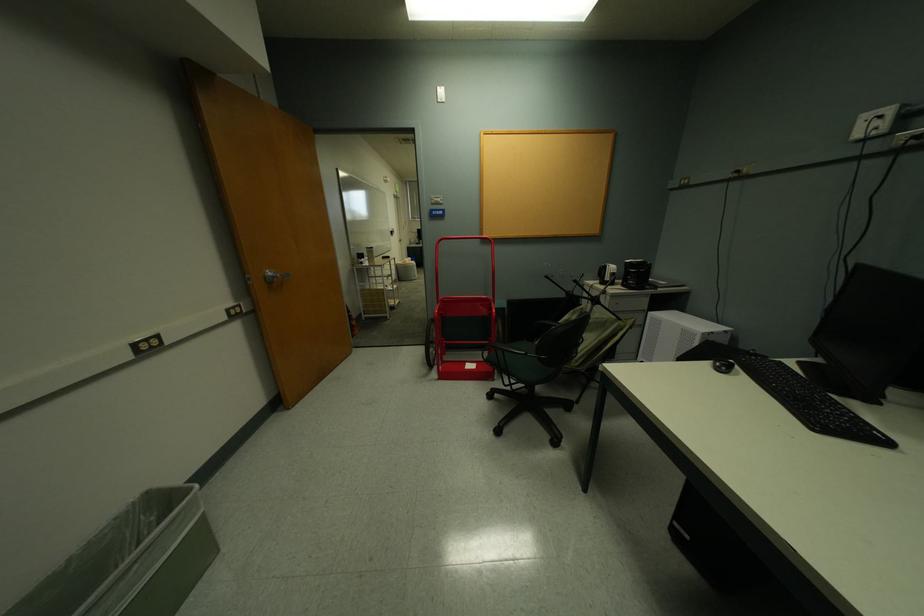
Locate an element on the screen. Image resolution: width=924 pixels, height=616 pixels. red dolly handle is located at coordinates (466, 240).